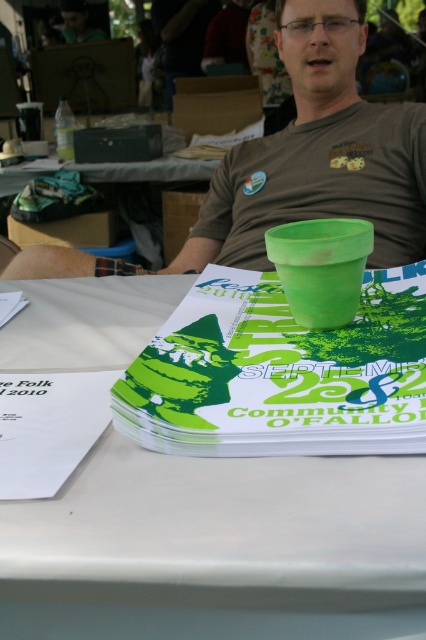
Question: Is white paper at center closer to the viewer compared to green paper at center?

Choices:
 (A) no
 (B) yes

Answer: (B)

Question: Which point is closer to the camera?

Choices:
 (A) green matte pot at center
 (B) white paper at center

Answer: (B)

Question: Which point is closer to the camera taking this photo?

Choices:
 (A) pyautogui.click(x=114, y=532)
 (B) pyautogui.click(x=298, y=125)
 (C) pyautogui.click(x=405, y=269)

Answer: (A)

Question: Is green paper at center wider than transparent plastic glasses at center?

Choices:
 (A) yes
 (B) no

Answer: (A)

Question: Observing the image, what is the correct spatial positioning of green paper at center in reference to matte green pot at upper center?

Choices:
 (A) right
 (B) left

Answer: (B)

Question: Which of the following is the farthest from the observer?

Choices:
 (A) pos(250,465)
 (B) pos(298,246)

Answer: (B)